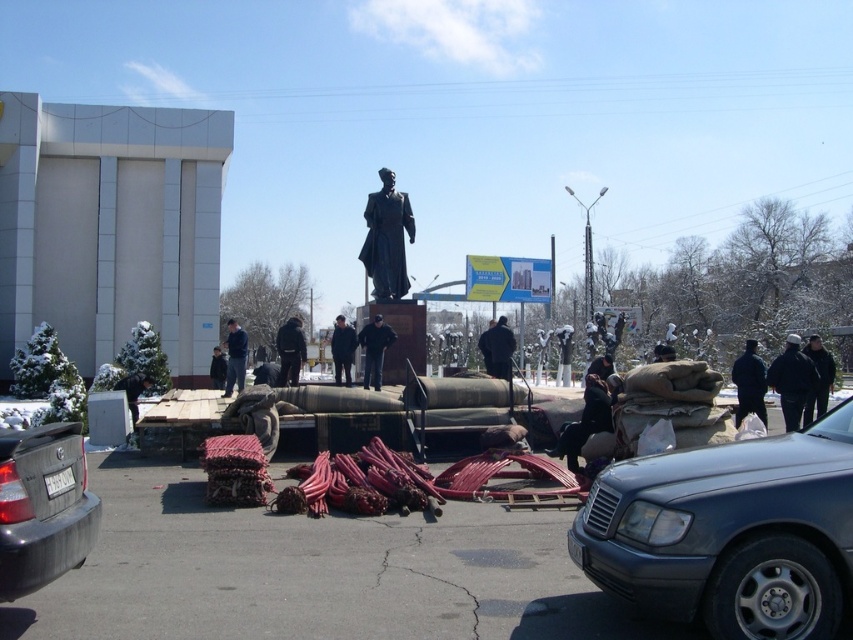
Question: Which is farther from the black matte coat at center?

Choices:
 (A) bronze statue at center
 (B) black matte jacket at lower right
 (C) black wool coat at center

Answer: (C)

Question: Does metallic blue sedan at center appear on the right side of black fabric bag at center?

Choices:
 (A) yes
 (B) no

Answer: (B)

Question: Which point is farther to the camera?

Choices:
 (A) black wool coat at center
 (B) black fabric jacket at center
 (C) black fabric bag at center
 (D) black matte pants at center

Answer: (B)

Question: Does black fabric jacket at lower right appear on the left side of black matte jacket at lower right?

Choices:
 (A) yes
 (B) no

Answer: (B)

Question: Can you confirm if black fabric bag at center is positioned to the left of black matte pants at center?

Choices:
 (A) yes
 (B) no

Answer: (B)

Question: Considering the real-world distances, which object is farthest from the metallic blue sedan at center?

Choices:
 (A) black fabric bag at center
 (B) matte black car at lower left

Answer: (A)